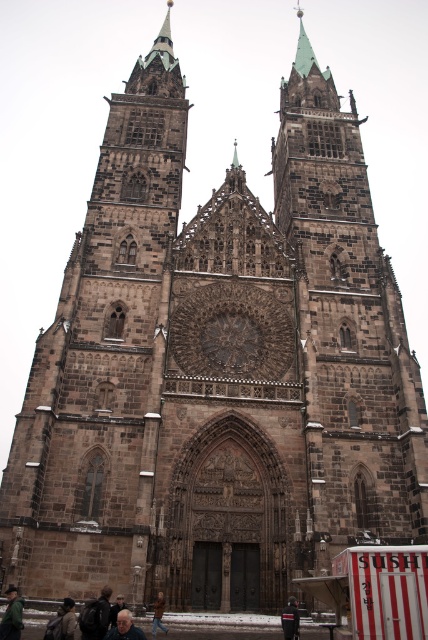
Based on the photo, you are a photographer planning to capture a closeup shot of the cathedral entrance. You notice two elements at the lower center of your viewfinder, the gray hair at lower center and the brown leather jacket at lower center. Which of these two elements would appear wider in your photo?

The gray hair at lower center appears wider in the photo because its width is larger than that of the brown leather jacket at lower center.

You are standing at the entrance of the Gothic cathedral and notice two features at lower center of the image. The gray hair at lower center and the dark gray jacket at lower center. Which one is closer to you?

The gray hair at lower center is 39.67 feet from the dark gray jacket at lower center, so the gray hair at lower center is closer to you than the dark gray jacket at lower center.